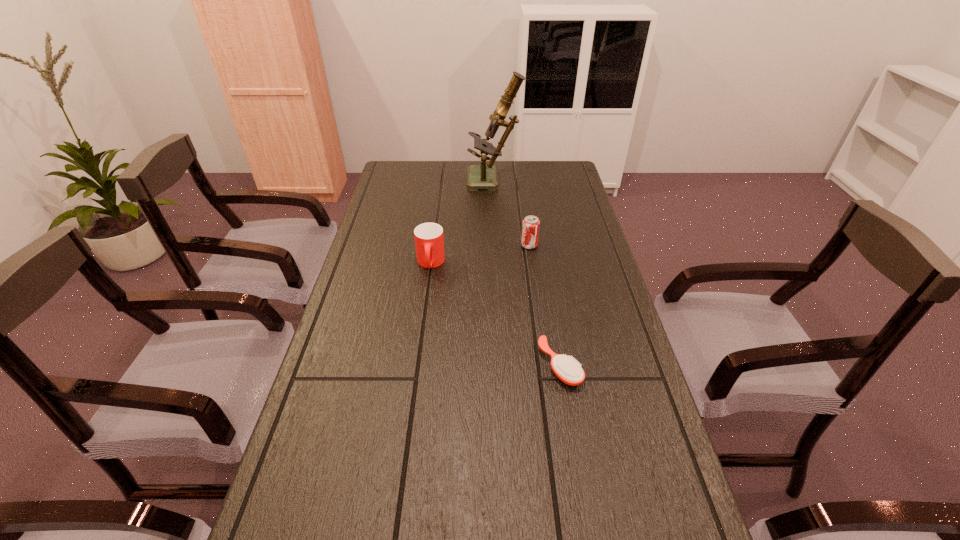
Find the location of a particular element. vacant area that lies between the nearest object and the cup is located at coordinates (495, 314).

I want to click on free space between the farthest object and the cup, so click(x=462, y=222).

Find the location of `empty location between the third nearest object and the farthest object`. empty location between the third nearest object and the farthest object is located at coordinates (512, 214).

This screenshot has height=540, width=960. I want to click on free spot between the farthest object and the third nearest object, so click(x=512, y=214).

I want to click on free point between the shortest object and the second nearest object, so click(x=495, y=314).

Identify the location of free space between the second farthest object and the nearest object. The image size is (960, 540). (544, 305).

Identify the location of vacant space in between the third nearest object and the shortest object. (544, 305).

This screenshot has height=540, width=960. Find the location of `object that is the second closest to the tallest object`. object that is the second closest to the tallest object is located at coordinates (429, 241).

Where is `object that stands as the third closest to the tallest object`? object that stands as the third closest to the tallest object is located at coordinates (568, 370).

Locate an element on the screen. vacant space that satisfies the following two spatial constraints: 1. on the side of the shortest object with the handle; 2. on the right side of the third farthest object is located at coordinates (417, 365).